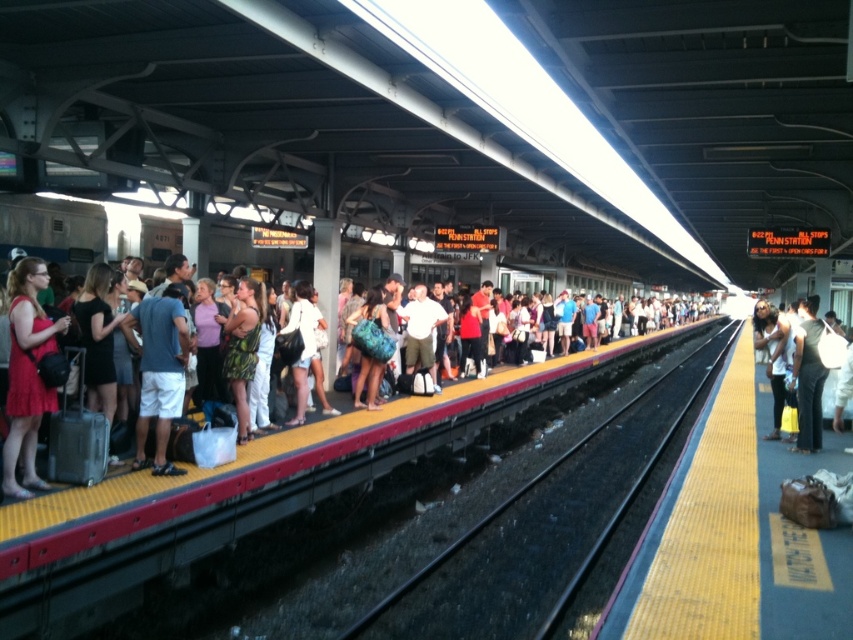
Question: Does black asphalt train track at center have a lesser width compared to matte black bag at right?

Choices:
 (A) no
 (B) yes

Answer: (A)

Question: Among these points, which one is farthest from the camera?

Choices:
 (A) (20, 324)
 (B) (469, 582)

Answer: (B)

Question: Does matte black crowd at left have a larger size compared to matte black bag at right?

Choices:
 (A) no
 (B) yes

Answer: (B)

Question: Among these points, which one is nearest to the camera?

Choices:
 (A) (567, 552)
 (B) (805, 330)

Answer: (A)

Question: Which of the following is the farthest from the observer?

Choices:
 (A) matte black bag at right
 (B) black asphalt train track at center
 (C) matte black crowd at left

Answer: (A)

Question: Can you confirm if black asphalt train track at center is wider than matte black crowd at left?

Choices:
 (A) no
 (B) yes

Answer: (B)